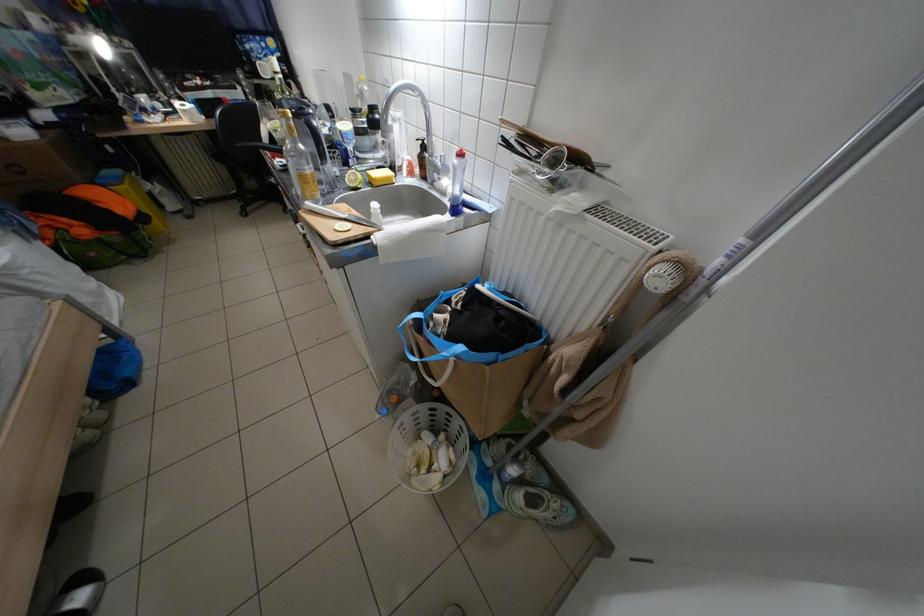
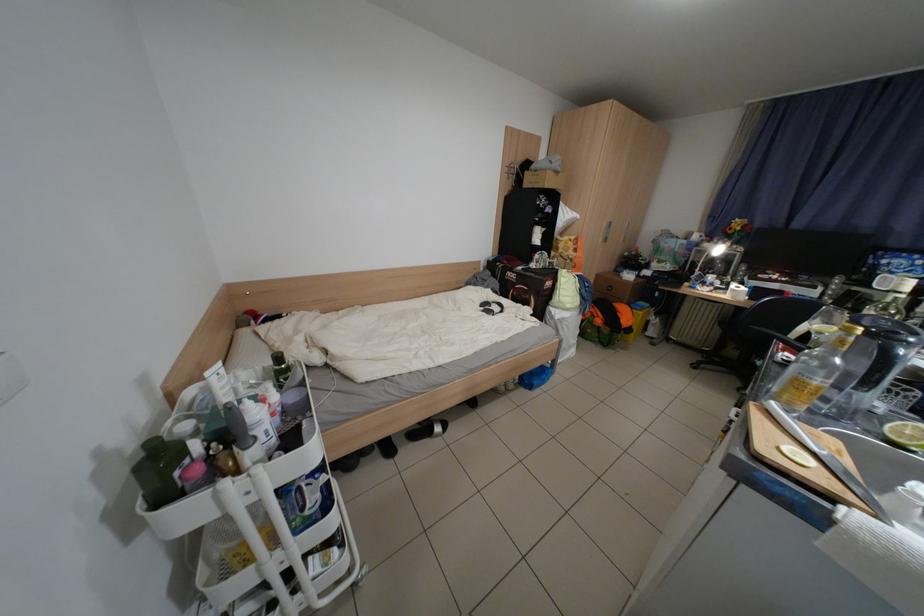
Question: The first image is from the beginning of the video and the second image is from the end. How did the camera likely rotate when shooting the video?

Choices:
 (A) Left
 (B) Right
 (C) Up
 (D) Down

Answer: (A)